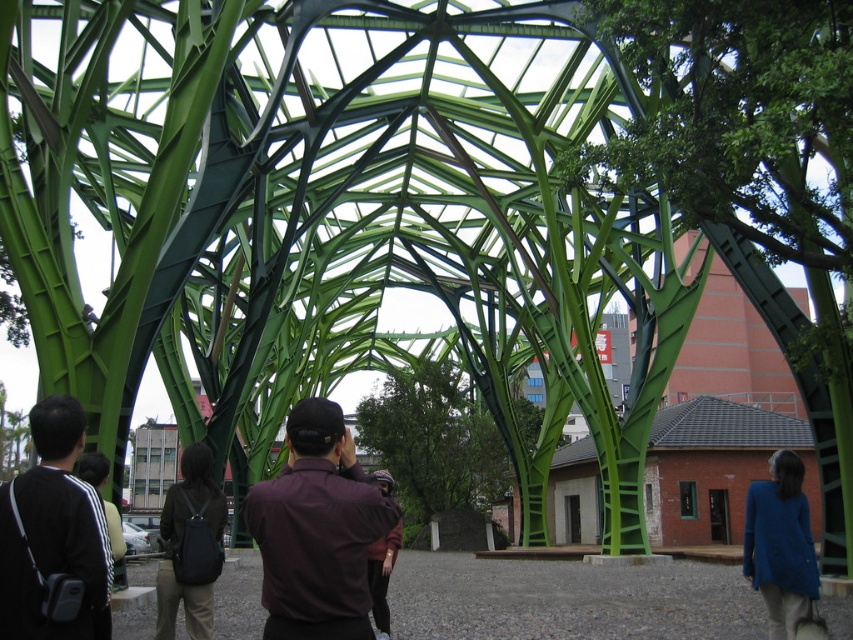
You are a photographer trying to capture the entire structure in your shot. You notice two people in the frame, a maroon fabric shirt at center and a dark gray fabric jacket at lower left. Which person should you ask to move to the right to avoid blocking the view of the central beams?

You should ask the dark gray fabric jacket at lower left to move to the right because the maroon fabric shirt at center is already positioned to the right of the dark gray fabric jacket at lower left, so moving the latter to the right would align them and possibly clear the central beams.

You are standing in front of the architectural structure and want to take a photo of the maroon fabric shirt at center and the dark gray fabric jacket at lower left. Which person should you focus on first to ensure they are in the frame?

The maroon fabric shirt at center is much taller than the dark gray fabric jacket at lower left, so you should focus on the maroon fabric shirt at center first to ensure they are in the frame.